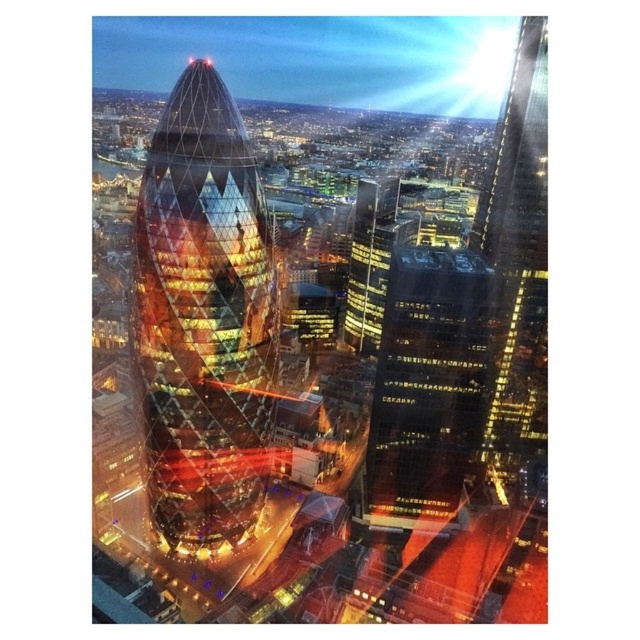
Can you confirm if glassy reflective skyscraper at center is bigger than glassy skyscraper at upper right?

Incorrect, glassy reflective skyscraper at center is not larger than glassy skyscraper at upper right.

Is point (432, 260) behind point (365, 256)?

No, (432, 260) is closer to viewer.

This screenshot has height=640, width=640. Find the location of `glassy reflective skyscraper at center`. glassy reflective skyscraper at center is located at coordinates (428, 385).

This screenshot has height=640, width=640. Describe the element at coordinates (204, 320) in the screenshot. I see `shiny glass tower at center` at that location.

Between shiny glass tower at center and glassy skyscraper at right, which one is positioned lower?

shiny glass tower at center

You are a GUI agent. You are given a task and a screenshot of the screen. Output one action in this format:
    pyautogui.click(x=<x>, y=<y>)
    Task: Click on the shiny glass tower at center
    
    Given the screenshot: What is the action you would take?
    pyautogui.click(x=204, y=320)

Which is below, glassy reflective building at center or glassy reflective skyscraper at center?

Positioned lower is glassy reflective skyscraper at center.

Consider the image. Is glassy reflective building at center taller than glassy reflective skyscraper at center?

Yes, glassy reflective building at center is taller than glassy reflective skyscraper at center.

Is point (310, 408) positioned after point (397, 460)?

Yes, it is.

I want to click on glassy reflective building at center, so click(x=330, y=364).